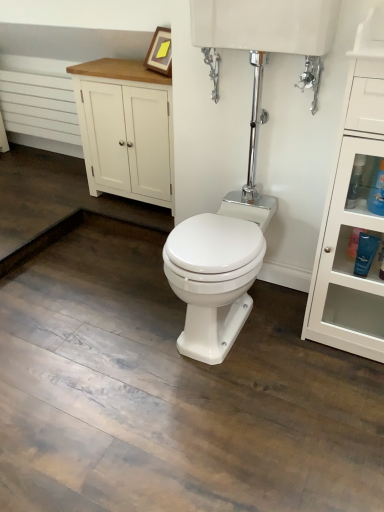
The width and height of the screenshot is (384, 512). In order to click on free point above white painted wood cabinet at upper left (from a real-world perspective) in this screenshot , I will do `click(118, 65)`.